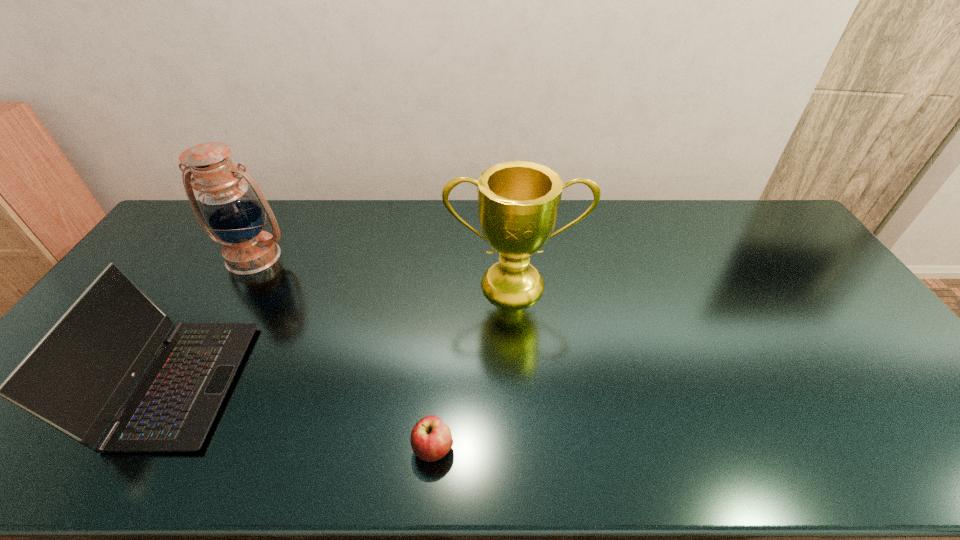
Where is `oil lamp`? The image size is (960, 540). oil lamp is located at coordinates (232, 208).

You are a GUI agent. You are given a task and a screenshot of the screen. Output one action in this format:
    pyautogui.click(x=<x>, y=<y>)
    Task: Click on the award
    The image size is (960, 540).
    Given the screenshot: What is the action you would take?
    pyautogui.click(x=518, y=201)

Where is `laptop computer`? Image resolution: width=960 pixels, height=540 pixels. laptop computer is located at coordinates (76, 378).

You are a GUI agent. You are given a task and a screenshot of the screen. Output one action in this format:
    pyautogui.click(x=<x>, y=<y>)
    Task: Click on the apple
    This screenshot has width=960, height=540.
    Given the screenshot: What is the action you would take?
    pyautogui.click(x=431, y=439)

The image size is (960, 540). I want to click on vacant region located 0.080m on the back of the oil lamp, so click(x=271, y=226).

The width and height of the screenshot is (960, 540). I want to click on vacant space situated on the shiny surface of the award, so click(521, 365).

Identify the location of vacant space located 0.400m on the screen of the second shortest object. (393, 383).

Where is `free location located 0.050m on the left of the shortest object`? This screenshot has width=960, height=540. free location located 0.050m on the left of the shortest object is located at coordinates (391, 448).

Image resolution: width=960 pixels, height=540 pixels. I want to click on laptop computer located at the near edge, so point(76,378).

The image size is (960, 540). Identify the location of apple that is at the near edge. (431, 439).